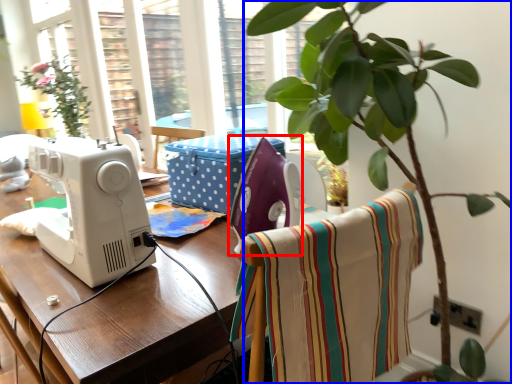
Question: Which of the following is the closest to the observer, sewing machine (highlighted by a red box) or houseplant (highlighted by a blue box)?

Choices:
 (A) sewing machine
 (B) houseplant

Answer: (B)